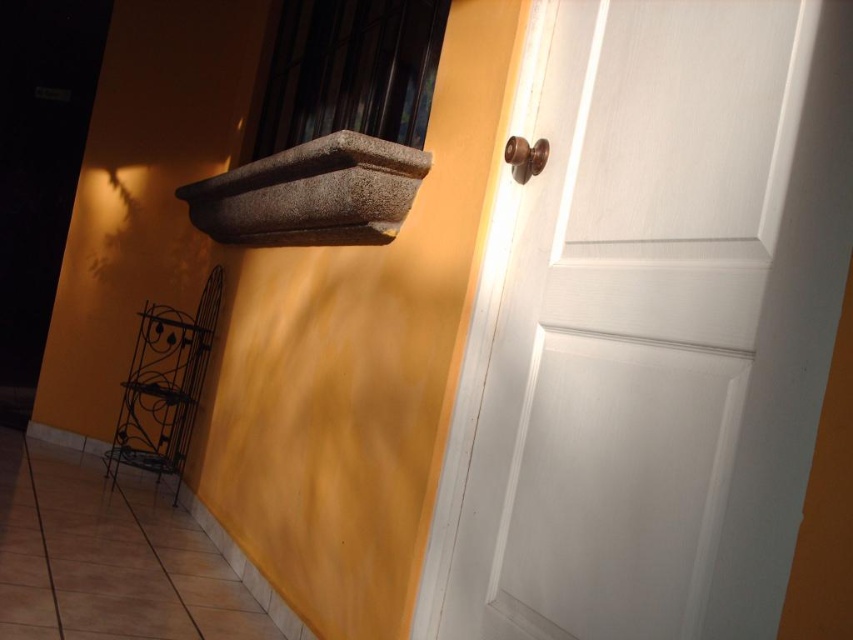
Who is higher up, white wood door at right or granite ledge at upper left?

granite ledge at upper left is higher up.

Can you confirm if white wood door at right is taller than granite ledge at upper left?

Indeed, white wood door at right has a greater height compared to granite ledge at upper left.

Image resolution: width=853 pixels, height=640 pixels. Identify the location of white wood door at right. (660, 324).

Is granite ledge at upper left smaller than brown polished door handle at upper right?

No, granite ledge at upper left is not smaller than brown polished door handle at upper right.

Is point (354, 161) in front of point (538, 157)?

No, (354, 161) is further to viewer.

Identify the location of granite ledge at upper left. (311, 195).

Can you confirm if white wood door at right is shorter than brown polished door handle at upper right?

In fact, white wood door at right may be taller than brown polished door handle at upper right.

Which is more to the right, white wood door at right or brown polished door handle at upper right?

white wood door at right

What do you see at coordinates (660, 324) in the screenshot? I see `white wood door at right` at bounding box center [660, 324].

Identify the location of white wood door at right. The width and height of the screenshot is (853, 640). (660, 324).